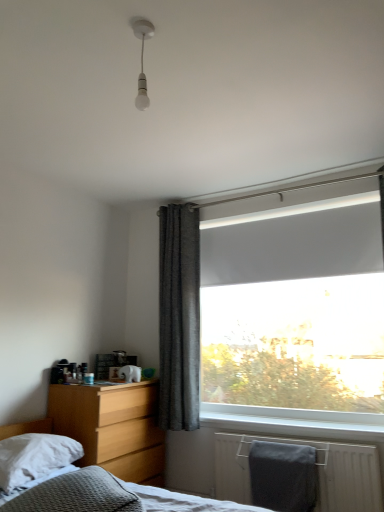
Question: Looking at their shapes, would you say textured gray bed at lower left is wider or thinner than gray matte towel at lower right?

Choices:
 (A) thin
 (B) wide

Answer: (B)

Question: From a real-world perspective, is textured gray bed at lower left physically located above or below gray matte towel at lower right?

Choices:
 (A) below
 (B) above

Answer: (A)

Question: Which object is the closest to the gray matte towel at lower right?

Choices:
 (A) white matte window screen at upper right
 (B) dark grey textured curtain at center
 (C) light wood/finish nightstand at lower left
 (D) white soft pillow at lower left
 (E) white glossy bulb at upper center

Answer: (C)

Question: Which of these objects is positioned closest to the light wood/finish nightstand at lower left?

Choices:
 (A) dark grey textured curtain at center
 (B) white matte window screen at upper right
 (C) white soft pillow at lower left
 (D) textured gray bed at lower left
 (E) gray matte towel at lower right

Answer: (C)